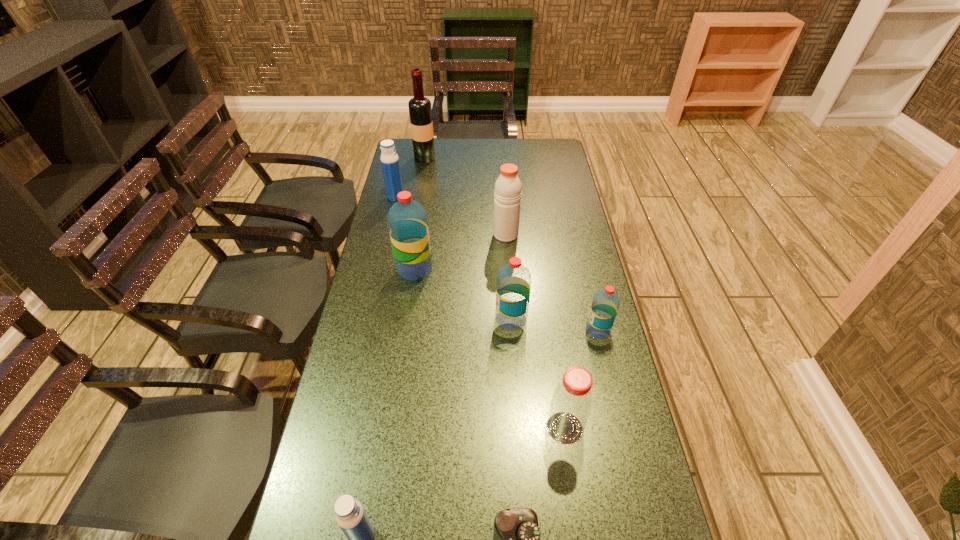
Identify the location of the farthest object. The width and height of the screenshot is (960, 540). (420, 112).

Locate an element on the screen. This screenshot has width=960, height=540. the tallest object is located at coordinates (420, 112).

Where is `the second farthest water bottle`? The width and height of the screenshot is (960, 540). the second farthest water bottle is located at coordinates (407, 219).

Locate an element on the screen. This screenshot has width=960, height=540. the leftmost red water bottle is located at coordinates (407, 219).

This screenshot has height=540, width=960. Identify the location of the seventh nearest object. (507, 194).

The width and height of the screenshot is (960, 540). Identify the location of orange shaker. (507, 194).

The image size is (960, 540). Find the location of `the bigger blue water bottle`. the bigger blue water bottle is located at coordinates (390, 165).

At what (x,y) coordinates should I click in order to perform the action: click on the leftmost object. Please return your answer as a coordinate pair (x, y). Looking at the image, I should click on (390, 165).

I want to click on the second smallest red water bottle, so click(x=513, y=286).

The width and height of the screenshot is (960, 540). What are the coordinates of `the second red water bottle from left to right` in the screenshot? It's located at (513, 286).